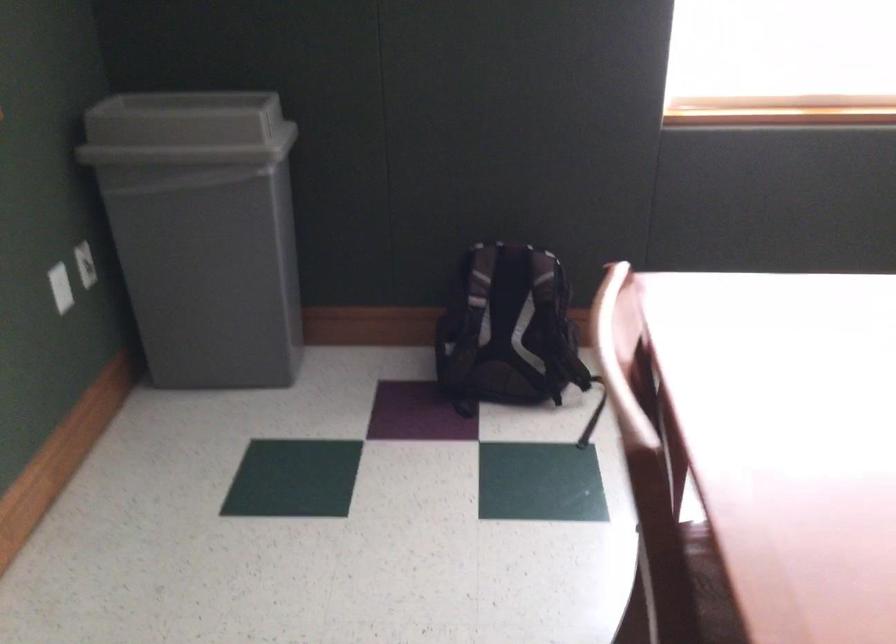
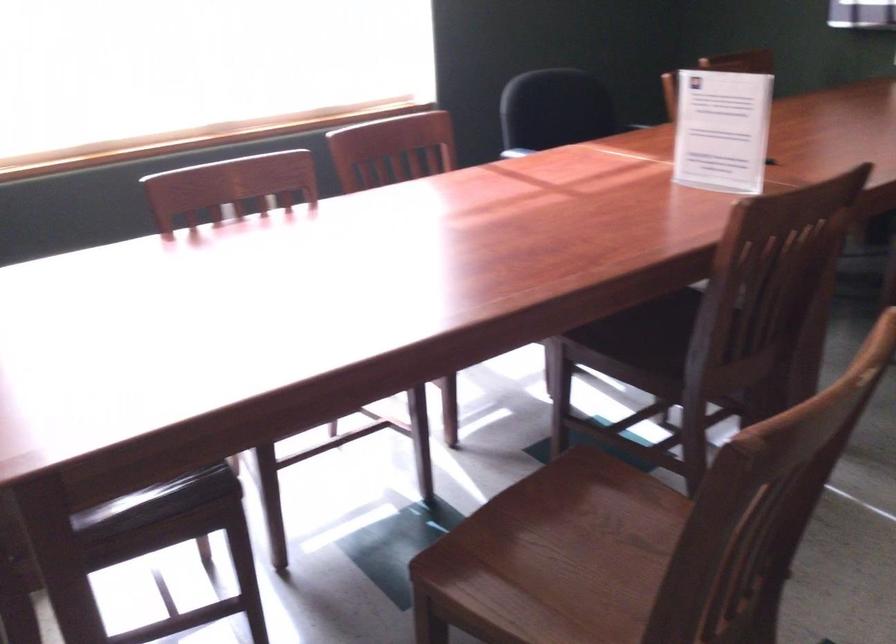
Question: How did the camera likely rotate?

Choices:
 (A) Left
 (B) Right
 (C) Up
 (D) Down

Answer: (B)